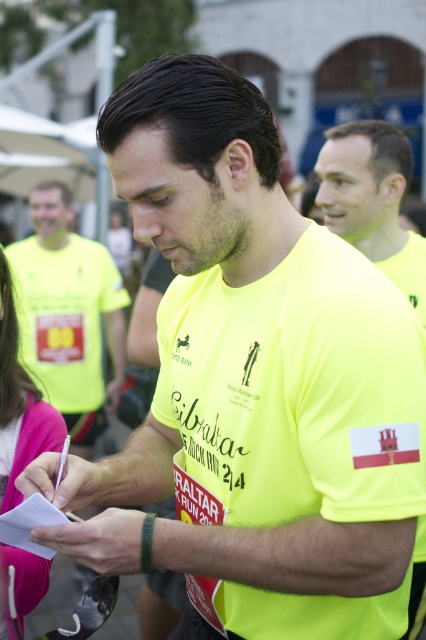
What do you see at coordinates (68, 314) in the screenshot? This screenshot has width=426, height=640. I see `neon yellow t-shirt at center` at bounding box center [68, 314].

Identify the location of neon yellow t-shirt at center. This screenshot has width=426, height=640. (68, 314).

Which is in front, point (97, 244) or point (362, 193)?

Point (362, 193) is more forward.

The height and width of the screenshot is (640, 426). Identify the location of neon yellow t-shirt at center. (68, 314).

Is yellow matte shirt at upper center thinner than pink fabric at lower left?

In fact, yellow matte shirt at upper center might be wider than pink fabric at lower left.

Is yellow matte shirt at upper center closer to the viewer compared to pink fabric at lower left?

No, yellow matte shirt at upper center is further to the viewer.

Find the location of `yellow matte shirt at upper center`. yellow matte shirt at upper center is located at coordinates (371, 198).

Is neon yellow t-shirt at center above pink fabric at lower left?

Yes.

Is point (81, 259) less distant than point (48, 561)?

No, it is behind (48, 561).

Identify the location of neon yellow t-shirt at center. (68, 314).